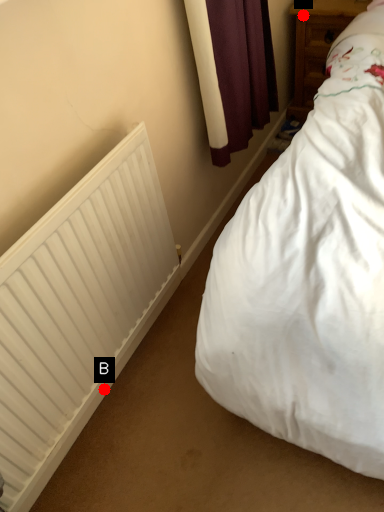
Question: Two points are circled on the image, labeled by A and B beside each circle. Which point is closer to the camera taking this photo?

Choices:
 (A) A is closer
 (B) B is closer

Answer: (B)